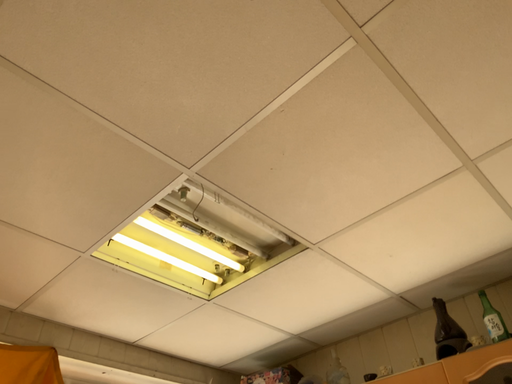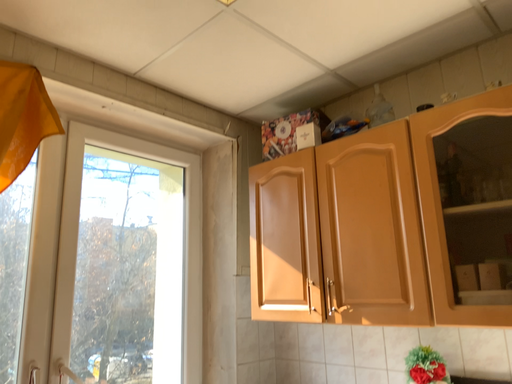
Question: Which way did the camera rotate in the video?

Choices:
 (A) rotated upward
 (B) rotated downward

Answer: (B)